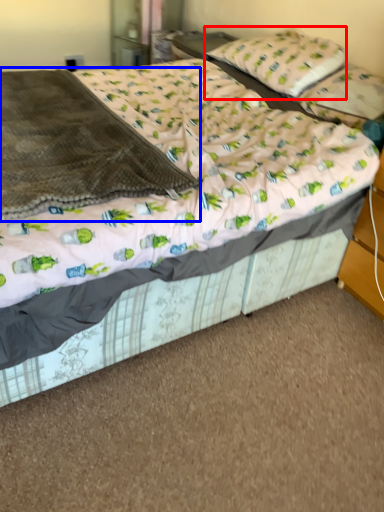
Question: Among these objects, which one is farthest to the camera, pillow (highlighted by a red box) or blanket (highlighted by a blue box)?

Choices:
 (A) pillow
 (B) blanket

Answer: (A)